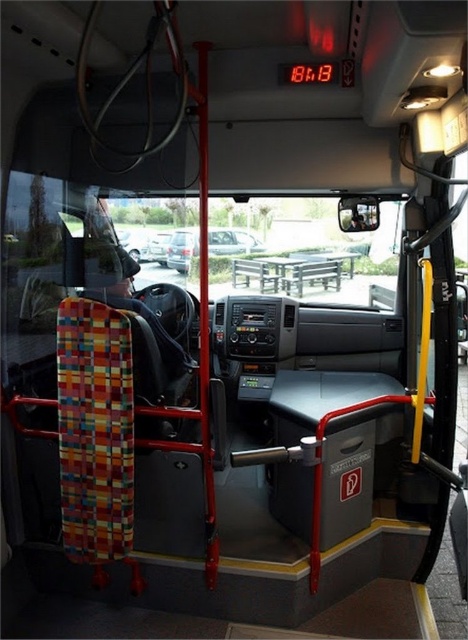
How much distance is there between metallic silver car at center and silver metallic sedan at center?

metallic silver car at center is 2.29 inches from silver metallic sedan at center.

Can you confirm if metallic silver car at center is wider than silver metallic sedan at center?

Indeed, metallic silver car at center has a greater width compared to silver metallic sedan at center.

Identify the location of metallic silver car at center. (182, 248).